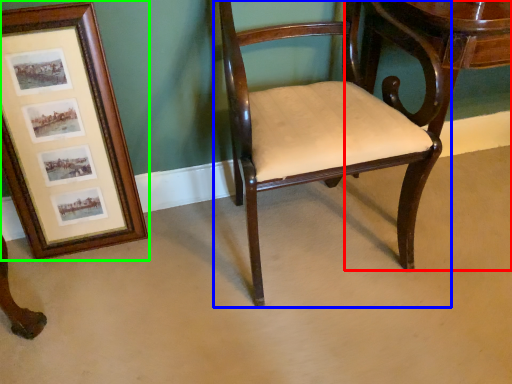
Question: Considering the real-world distances, which object is closest to table (highlighted by a red box)? chair (highlighted by a blue box) or picture frame (highlighted by a green box).

Choices:
 (A) chair
 (B) picture frame

Answer: (A)